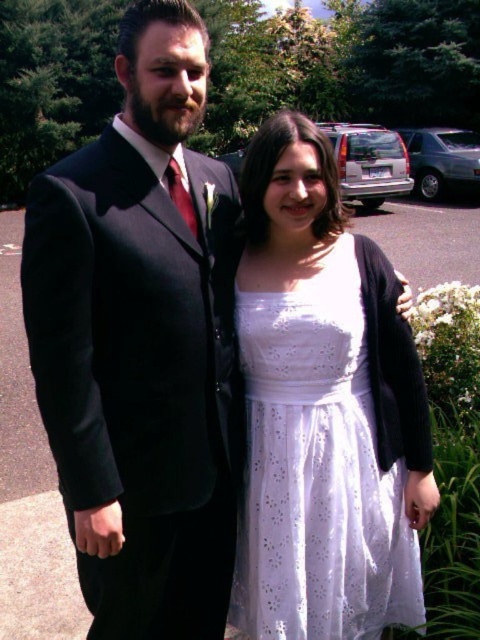
Does dark gray wool suit at left have a greater height compared to white lace dress at center?

Yes.

Is the position of dark gray wool suit at left less distant than that of white lace dress at center?

Yes, it is in front of white lace dress at center.

Does point (27, 291) come behind point (252, 413)?

No, (27, 291) is closer to viewer.

Where is `dark gray wool suit at left`? dark gray wool suit at left is located at coordinates [140, 378].